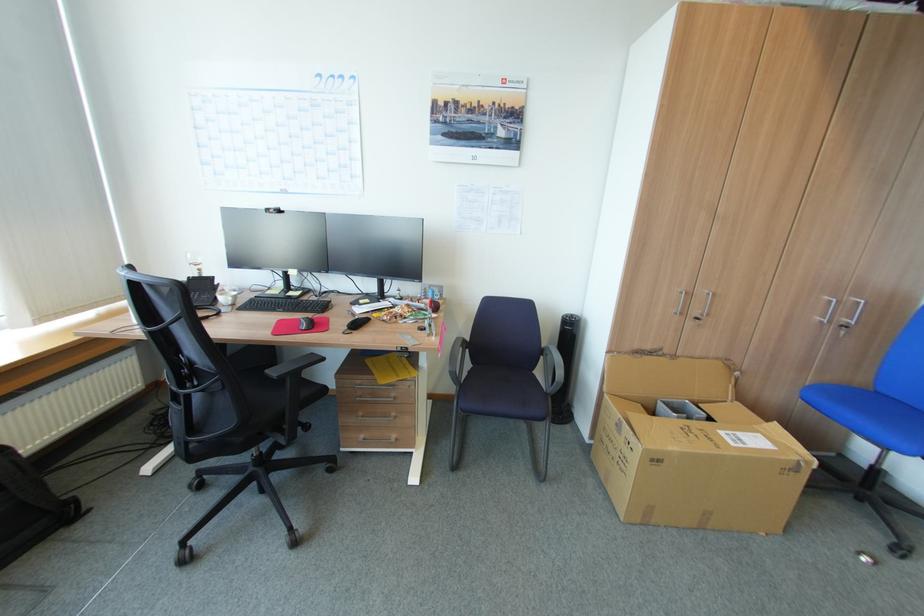
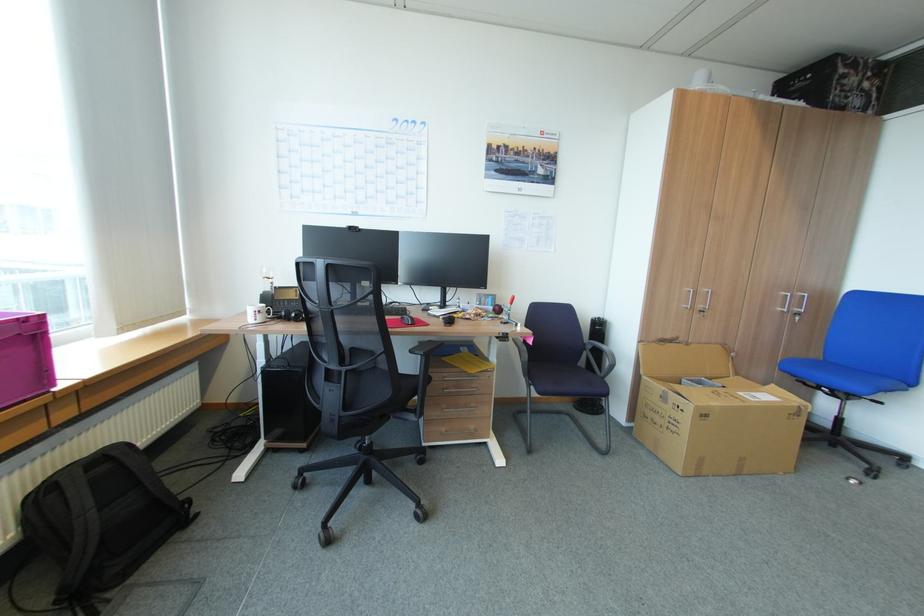
Find the pixel in the second image that matches the point at 687,313 in the first image.

(698, 307)